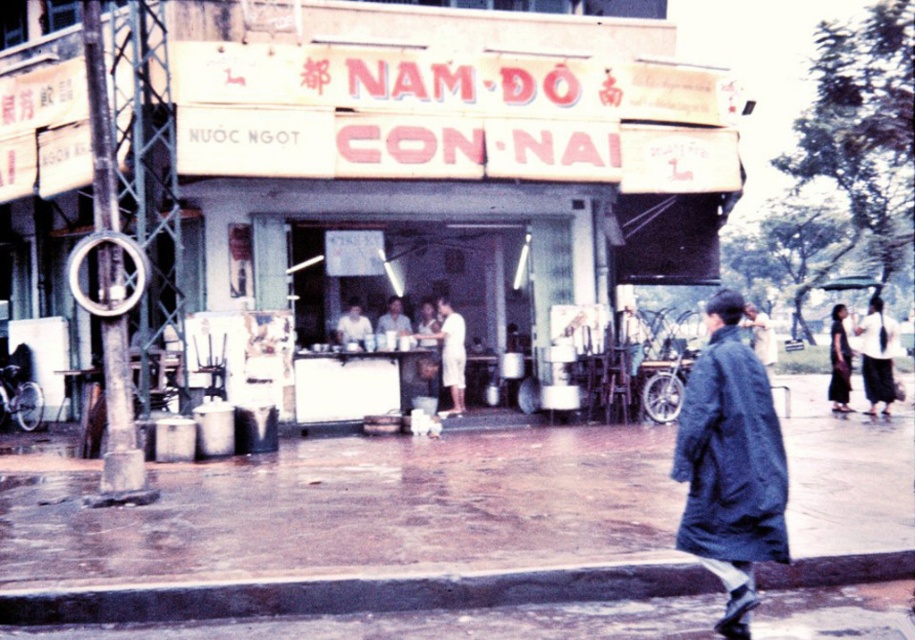
Is yellowish faded signboard at center in front of white matte shirt at center?

Yes, it is.

Can you confirm if yellowish faded signboard at center is smaller than white matte shirt at center?

Yes, yellowish faded signboard at center is smaller than white matte shirt at center.

Measure the distance between yellowish faded signboard at center and camera.

yellowish faded signboard at center and camera are 10.40 meters apart.

Locate an element on the screen. Image resolution: width=915 pixels, height=640 pixels. yellowish faded signboard at center is located at coordinates (407, 164).

Between wet asphalt pavement at lower center and dark blue fabric dress at right, which one appears on the left side from the viewer's perspective?

Positioned to the left is wet asphalt pavement at lower center.

Based on the photo, between wet asphalt pavement at lower center and dark blue fabric dress at right, which one has more height?

With more height is dark blue fabric dress at right.

Is point (540, 528) farther from camera compared to point (836, 380)?

No, (540, 528) is closer to viewer.

At what (x,y) coordinates should I click in order to perform the action: click on wet asphalt pavement at lower center. Please return your answer as a coordinate pair (x, y). Looking at the image, I should click on (357, 529).

Is wet asphalt pavement at lower center shorter than dark blue fabric coat at lower right?

Indeed, wet asphalt pavement at lower center has a lesser height compared to dark blue fabric coat at lower right.

Is point (82, 524) in front of point (748, 538)?

No.

The image size is (915, 640). I want to click on wet asphalt pavement at lower center, so click(x=357, y=529).